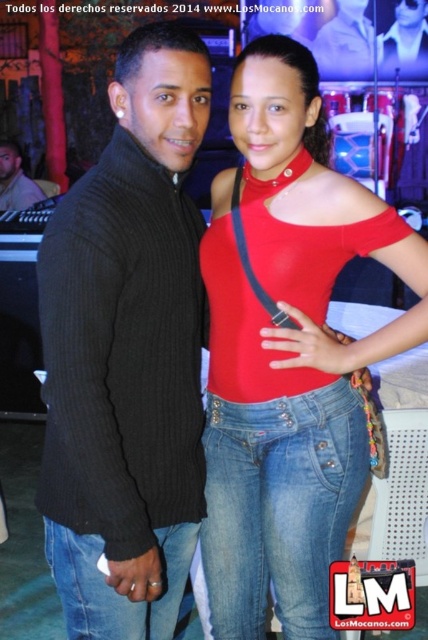
Question: Which point appears farthest from the camera in this image?

Choices:
 (A) (305, 372)
 (B) (11, 163)

Answer: (B)

Question: Is black ribbed sweater at center thinner than matte red top at center?

Choices:
 (A) yes
 (B) no

Answer: (A)

Question: Which of these objects is positioned farthest from the matte black sweater at center?

Choices:
 (A) black ribbed sweater at center
 (B) matte red top at center

Answer: (A)

Question: Which object is the closest to the matte red top at center?

Choices:
 (A) matte black sweater at center
 (B) black ribbed sweater at center

Answer: (B)

Question: Can you confirm if black ribbed sweater at center is positioned above matte black sweater at center?

Choices:
 (A) no
 (B) yes

Answer: (A)

Question: Does black ribbed sweater at center have a smaller size compared to matte red top at center?

Choices:
 (A) no
 (B) yes

Answer: (B)